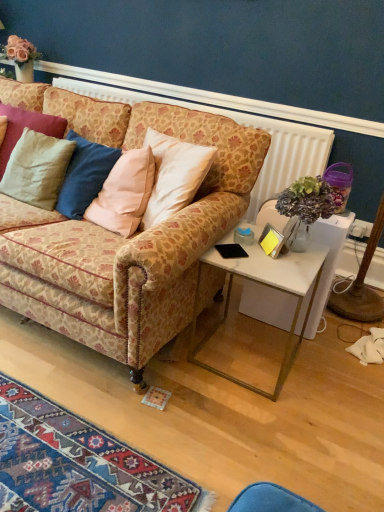
Question: Can you confirm if patterned fabric couch at center is shorter than white marble side table at right?

Choices:
 (A) no
 (B) yes

Answer: (A)

Question: Considering the relative positions of patterned fabric couch at center and white marble side table at right in the image provided, is patterned fabric couch at center in front of white marble side table at right?

Choices:
 (A) yes
 (B) no

Answer: (A)

Question: Is patterned fabric couch at center not close to white marble side table at right?

Choices:
 (A) yes
 (B) no

Answer: (B)

Question: Does patterned fabric couch at center touch white marble side table at right?

Choices:
 (A) yes
 (B) no

Answer: (B)

Question: Does patterned fabric couch at center have a larger size compared to white marble side table at right?

Choices:
 (A) no
 (B) yes

Answer: (B)

Question: Is patterned fabric couch at center aimed at white marble side table at right?

Choices:
 (A) no
 (B) yes

Answer: (A)

Question: Does white marble side table at right come in front of matte beige pillow at left, positioned as the 1th pillow in bottom-to-top order?

Choices:
 (A) yes
 (B) no

Answer: (A)

Question: From a real-world perspective, is white marble side table at right below matte beige pillow at left, positioned as the 1th pillow in bottom-to-top order?

Choices:
 (A) no
 (B) yes

Answer: (B)

Question: Would you say white marble side table at right contains matte beige pillow at left, the second pillow from the top?

Choices:
 (A) yes
 (B) no

Answer: (B)

Question: Is white marble side table at right not near matte beige pillow at left, positioned as the 1th pillow in bottom-to-top order?

Choices:
 (A) yes
 (B) no

Answer: (A)

Question: From a real-world perspective, is white marble side table at right positioned over matte beige pillow at left, the second pillow from the top, based on gravity?

Choices:
 (A) yes
 (B) no

Answer: (B)

Question: Considering the relative positions of white marble side table at right and matte beige pillow at left, the second pillow from the top, in the image provided, is white marble side table at right to the right of matte beige pillow at left, the second pillow from the top, from the viewer's perspective?

Choices:
 (A) yes
 (B) no

Answer: (A)

Question: Is matte beige pillow at left, the second pillow from the top, not close to matte beige pillow at left, the 2th pillow positioned from the bottom?

Choices:
 (A) yes
 (B) no

Answer: (B)